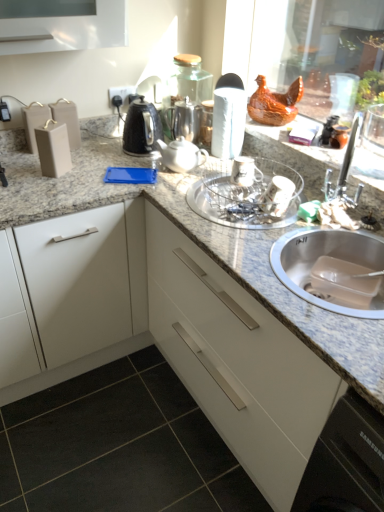
Question: Does black glossy kettle at center appear on the left side of clear glass bowl at center?

Choices:
 (A) no
 (B) yes

Answer: (B)

Question: From the image's perspective, is black glossy kettle at center above clear glass bowl at center?

Choices:
 (A) no
 (B) yes

Answer: (B)

Question: Is black glossy kettle at center not inside clear glass bowl at center?

Choices:
 (A) no
 (B) yes

Answer: (B)

Question: Is the position of black glossy kettle at center less distant than that of clear glass bowl at center?

Choices:
 (A) no
 (B) yes

Answer: (A)

Question: Is black glossy kettle at center wider than clear glass bowl at center?

Choices:
 (A) no
 (B) yes

Answer: (A)

Question: Is black glossy kettle at center bigger than clear glass bowl at center?

Choices:
 (A) no
 (B) yes

Answer: (A)

Question: Is white glossy teapot at center, the 1th tea pot from the front, aimed at white matte cabinet at left, the 1th cabinetry from the left?

Choices:
 (A) no
 (B) yes

Answer: (B)

Question: Would you say white glossy teapot at center, the 1th tea pot from the front, is outside white matte cabinet at left, the 1th cabinetry from the left?

Choices:
 (A) no
 (B) yes

Answer: (B)

Question: Does white glossy teapot at center, the 1th tea pot from the front, touch white matte cabinet at left, the 1th cabinetry from the left?

Choices:
 (A) yes
 (B) no

Answer: (B)

Question: Is the depth of white glossy teapot at center, the 1th tea pot from the front, greater than that of white matte cabinet at left, the 1th cabinetry from the left?

Choices:
 (A) no
 (B) yes

Answer: (B)

Question: From a real-world perspective, is white glossy teapot at center, the 1th tea pot from the front, over white matte cabinet at left, the 1th cabinetry from the left?

Choices:
 (A) yes
 (B) no

Answer: (A)

Question: From a real-world perspective, is white glossy teapot at center, which is counted as the second tea pot, starting from the back, beneath white matte cabinet at left, the 1th cabinetry from the left?

Choices:
 (A) yes
 (B) no

Answer: (B)

Question: Is metallic silver shaker at upper center, marked as the first appliance in a right-to-left arrangement, at the left side of silver metallic sink at lower right?

Choices:
 (A) yes
 (B) no

Answer: (A)